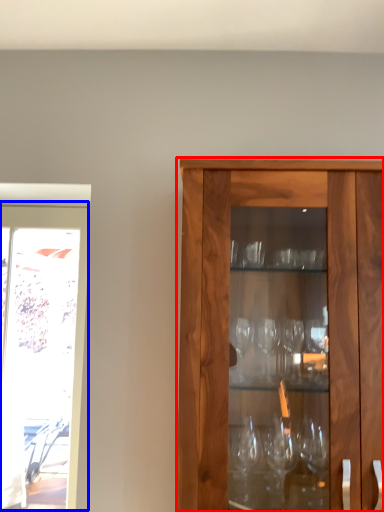
Question: Which point is closer to the camera, cabinetry (highlighted by a red box) or screen door (highlighted by a blue box)?

Choices:
 (A) cabinetry
 (B) screen door

Answer: (A)